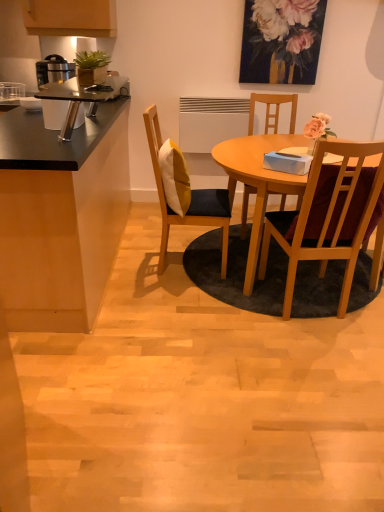
This screenshot has height=512, width=384. Find the location of `floral painting at upper center`. floral painting at upper center is located at coordinates (286, 35).

This screenshot has height=512, width=384. What do you see at coordinates (270, 110) in the screenshot?
I see `wooden chair at center, which is the second chair in left-to-right order` at bounding box center [270, 110].

Describe the element at coordinates (60, 217) in the screenshot. I see `black matte cabinet at left` at that location.

The height and width of the screenshot is (512, 384). What do you see at coordinates (327, 218) in the screenshot?
I see `wooden chair at center right, which ranks as the first chair in right-to-left order` at bounding box center [327, 218].

Find the location of a particular element. This screenshot has width=384, height=512. floral painting at upper center is located at coordinates (286, 35).

Which of these two, wooden chair with cushion at center, which ranks as the 1th chair in left-to-right order, or wooden chair at center, arranged as the 2th chair when viewed from the right, stands taller?

Standing taller between the two is wooden chair with cushion at center, which ranks as the 1th chair in left-to-right order.

From a real-world perspective, relative to wooden chair at center, which is the second chair in left-to-right order, is wooden chair with cushion at center, the 3th chair from the right, vertically above or below?

wooden chair with cushion at center, the 3th chair from the right, is above wooden chair at center, which is the second chair in left-to-right order.

Is wooden chair with cushion at center, which ranks as the 1th chair in left-to-right order, situated inside wooden chair at center, which is the second chair in left-to-right order, or outside?

The correct answer is: outside.

Image resolution: width=384 pixels, height=512 pixels. I want to click on the 1st chair positioned above the wooden chair at center, which is the second chair in left-to-right order (from a real-world perspective), so click(191, 200).

How many degrees apart are the facing directions of wooden chair at center, which is the second chair in left-to-right order, and wooden chair at center right, the 3th chair from the left?

The angular difference between wooden chair at center, which is the second chair in left-to-right order, and wooden chair at center right, the 3th chair from the left, is 177 degrees.

Is wooden chair at center, which is the second chair in left-to-right order, next to wooden chair at center right, the 3th chair from the left?

No, wooden chair at center, which is the second chair in left-to-right order, is not next to wooden chair at center right, the 3th chair from the left.

Is the position of wooden chair at center, arranged as the 2th chair when viewed from the right, more distant than that of wooden chair at center right, the 3th chair from the left?

Yes, wooden chair at center, arranged as the 2th chair when viewed from the right, is further from the viewer.

Is wooden chair at center, arranged as the 2th chair when viewed from the right, thinner than wooden chair at center right, the 3th chair from the left?

No, wooden chair at center, arranged as the 2th chair when viewed from the right, is not thinner than wooden chair at center right, the 3th chair from the left.

Consider the image. What's the angular difference between wooden chair at center, arranged as the 2th chair when viewed from the right, and black matte cabinet at left's facing directions?

86.5 degrees separate the facing orientations of wooden chair at center, arranged as the 2th chair when viewed from the right, and black matte cabinet at left.

Which is more to the left, wooden chair at center, arranged as the 2th chair when viewed from the right, or black matte cabinet at left?

From the viewer's perspective, black matte cabinet at left appears more on the left side.

From a real-world perspective, which object rests below the other?

black matte cabinet at left is physically lower.

Is wooden chair at center, which is the second chair in left-to-right order, far from black matte cabinet at left?

Yes.

Considering the positions of objects wooden chair with cushion at center, the 3th chair from the right, and wooden chair at center right, the 3th chair from the left, in the image provided, who is behind, wooden chair with cushion at center, the 3th chair from the right, or wooden chair at center right, the 3th chair from the left,?

wooden chair with cushion at center, the 3th chair from the right, is behind.

Is wooden chair with cushion at center, which ranks as the 1th chair in left-to-right order, to the right of wooden chair at center right, the 3th chair from the left, from the viewer's perspective?

No, wooden chair with cushion at center, which ranks as the 1th chair in left-to-right order, is not to the right of wooden chair at center right, the 3th chair from the left.

From the image's perspective, is wooden chair with cushion at center, which ranks as the 1th chair in left-to-right order, located above wooden chair at center right, which ranks as the first chair in right-to-left order?

Yes, from the image's perspective, wooden chair with cushion at center, which ranks as the 1th chair in left-to-right order, is on top of wooden chair at center right, which ranks as the first chair in right-to-left order.

Considering the sizes of wooden chair with cushion at center, which ranks as the 1th chair in left-to-right order, and wooden chair at center right, which ranks as the first chair in right-to-left order, in the image, is wooden chair with cushion at center, which ranks as the 1th chair in left-to-right order, bigger or smaller than wooden chair at center right, which ranks as the first chair in right-to-left order,?

Clearly, wooden chair with cushion at center, which ranks as the 1th chair in left-to-right order, is larger in size than wooden chair at center right, which ranks as the first chair in right-to-left order.

Is wooden chair at center, which is the second chair in left-to-right order, spatially inside wooden chair with cushion at center, which ranks as the 1th chair in left-to-right order, or outside of it?

wooden chair at center, which is the second chair in left-to-right order, is spatially situated outside wooden chair with cushion at center, which ranks as the 1th chair in left-to-right order.

Is there a large distance between wooden chair at center, arranged as the 2th chair when viewed from the right, and wooden chair with cushion at center, which ranks as the 1th chair in left-to-right order?

Yes, wooden chair at center, arranged as the 2th chair when viewed from the right, and wooden chair with cushion at center, which ranks as the 1th chair in left-to-right order, are quite far apart.

Based on the photo, from the image's perspective, does wooden chair at center, arranged as the 2th chair when viewed from the right, appear lower than wooden chair with cushion at center, which ranks as the 1th chair in left-to-right order?

No, from the image's perspective, wooden chair at center, arranged as the 2th chair when viewed from the right, is not below wooden chair with cushion at center, which ranks as the 1th chair in left-to-right order.

Does point (267, 108) appear closer or farther from the camera than point (156, 111)?

Point (267, 108) appears to be closer to the viewer than point (156, 111).

What's the angular difference between wooden chair at center right, the 3th chair from the left, and wooden chair at center, which is the second chair in left-to-right order,'s facing directions?

The angle between the facing direction of wooden chair at center right, the 3th chair from the left, and the facing direction of wooden chair at center, which is the second chair in left-to-right order, is 177 degrees.

Is wooden chair at center right, the 3th chair from the left, positioned with its back to wooden chair at center, arranged as the 2th chair when viewed from the right?

No, wooden chair at center right, the 3th chair from the left, is not facing away from wooden chair at center, arranged as the 2th chair when viewed from the right.

Is wooden chair at center right, which ranks as the first chair in right-to-left order, with wooden chair at center, which is the second chair in left-to-right order?

No, wooden chair at center right, which ranks as the first chair in right-to-left order, is not in contact with wooden chair at center, which is the second chair in left-to-right order.

Can you confirm if wooden chair at center right, the 3th chair from the left, is shorter than wooden chair at center, arranged as the 2th chair when viewed from the right?

No, wooden chair at center right, the 3th chair from the left, is not shorter than wooden chair at center, arranged as the 2th chair when viewed from the right.

Is floral painting at upper center taller or shorter than wooden chair at center right, which ranks as the first chair in right-to-left order?

In the image, floral painting at upper center appears to be shorter than wooden chair at center right, which ranks as the first chair in right-to-left order.

Find the location of a particular element. The image size is (384, 512). the 3rd chair in front when counting from the floral painting at upper center is located at coordinates (327, 218).

Is floral painting at upper center placed right next to wooden chair at center right, the 3th chair from the left?

No, floral painting at upper center is not in contact with wooden chair at center right, the 3th chair from the left.

The width and height of the screenshot is (384, 512). Find the location of `the 1st chair to the right of the wooden chair with cushion at center, which ranks as the 1th chair in left-to-right order, starting your count from the anchor`. the 1st chair to the right of the wooden chair with cushion at center, which ranks as the 1th chair in left-to-right order, starting your count from the anchor is located at coordinates (270, 110).

Locate an element on the screen. chair that is the 2nd one above the wooden chair at center, which is the second chair in left-to-right order (from a real-world perspective) is located at coordinates (327, 218).

Based on their spatial positions, is wooden chair with cushion at center, which ranks as the 1th chair in left-to-right order, or black matte cabinet at left closer to wooden chair at center right, the 3th chair from the left?

wooden chair with cushion at center, which ranks as the 1th chair in left-to-right order, is positioned closer to the anchor wooden chair at center right, the 3th chair from the left.

From the image, which object appears to be farther from black matte cabinet at left, wooden chair with cushion at center, which ranks as the 1th chair in left-to-right order, or wooden chair at center, which is the second chair in left-to-right order?

wooden chair at center, which is the second chair in left-to-right order, is positioned further to the anchor black matte cabinet at left.

Based on their spatial positions, is wooden chair with cushion at center, the 3th chair from the right, or black matte cabinet at left closer to floral painting at upper center?

The object closer to floral painting at upper center is wooden chair with cushion at center, the 3th chair from the right.

Which object lies nearer to the anchor point wooden chair with cushion at center, which ranks as the 1th chair in left-to-right order, wooden chair at center, which is the second chair in left-to-right order, or wooden chair at center right, the 3th chair from the left?

Based on the image, wooden chair at center right, the 3th chair from the left, appears to be nearer to wooden chair with cushion at center, which ranks as the 1th chair in left-to-right order.

From the image, which object appears to be farther from black matte cabinet at left, wooden chair at center, arranged as the 2th chair when viewed from the right, or wooden chair at center right, the 3th chair from the left?

wooden chair at center, arranged as the 2th chair when viewed from the right, lies further to black matte cabinet at left than the other object.

Looking at this image, from the image, which object appears to be farther from floral painting at upper center, wooden chair with cushion at center, which ranks as the 1th chair in left-to-right order, or wooden chair at center right, which ranks as the first chair in right-to-left order?

wooden chair at center right, which ranks as the first chair in right-to-left order, is positioned further to the anchor floral painting at upper center.

Looking at the image, which one is located closer to wooden chair with cushion at center, which ranks as the 1th chair in left-to-right order, wooden chair at center right, which ranks as the first chair in right-to-left order, or floral painting at upper center?

wooden chair at center right, which ranks as the first chair in right-to-left order, is positioned closer to the anchor wooden chair with cushion at center, which ranks as the 1th chair in left-to-right order.

Which object lies further to the anchor point wooden chair with cushion at center, the 3th chair from the right, wooden chair at center right, which ranks as the first chair in right-to-left order, or black matte cabinet at left?

Among the two, wooden chair at center right, which ranks as the first chair in right-to-left order, is located further to wooden chair with cushion at center, the 3th chair from the right.

Find the location of a particular element. The height and width of the screenshot is (512, 384). chair between wooden chair at center right, the 3th chair from the left, and wooden chair at center, arranged as the 2th chair when viewed from the right, along the z-axis is located at coordinates click(191, 200).

Find the location of a particular element. chair between floral painting at upper center and wooden chair with cushion at center, which ranks as the 1th chair in left-to-right order, in the up-down direction is located at coordinates (270, 110).

The height and width of the screenshot is (512, 384). I want to click on chair located between black matte cabinet at left and wooden chair at center, arranged as the 2th chair when viewed from the right, in the left-right direction, so click(191, 200).